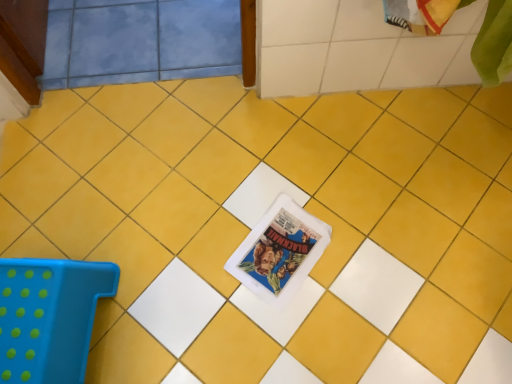
Locate an element on the screen. The height and width of the screenshot is (384, 512). free space to the back side of blue plastic stool at lower left is located at coordinates (81, 219).